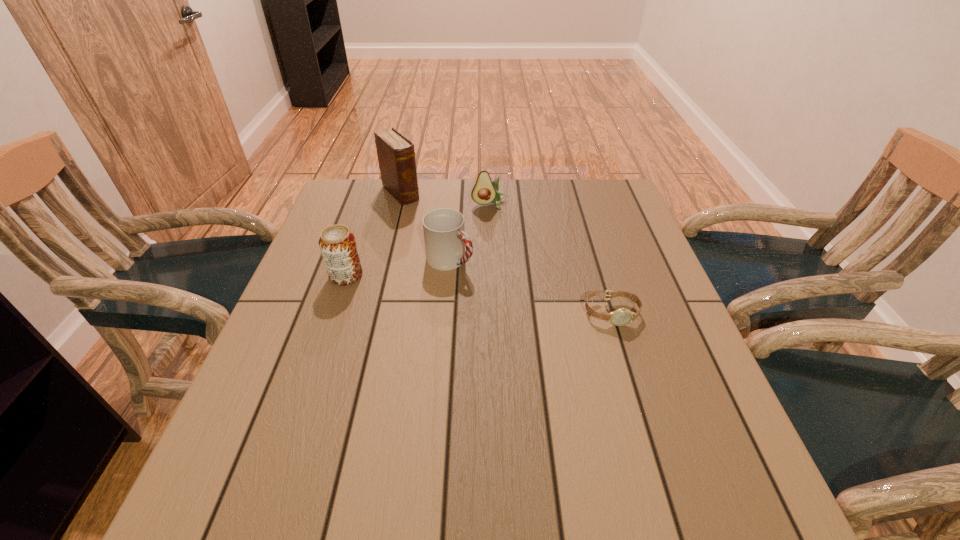
This screenshot has height=540, width=960. I want to click on vacant space on the desktop that is between the beer can and the nearest object and is positioned on the spine side of the tallest object, so coord(512,299).

At what (x,y) coordinates should I click in order to perform the action: click on vacant space on the desktop that is between the beer can and the shortest object and is positioned on the side of the cup where the handle is located. Please return your answer as a coordinate pair (x, y). The image size is (960, 540). Looking at the image, I should click on (513, 299).

I want to click on free space on the desktop that is between the beer can and the rightmost object and is positioned on the seed side of the avocado, so click(x=510, y=299).